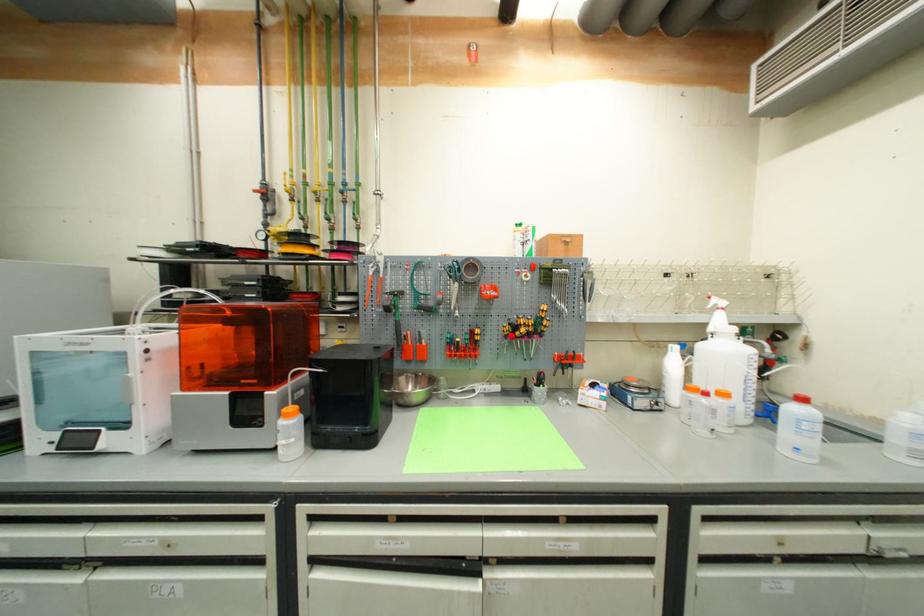
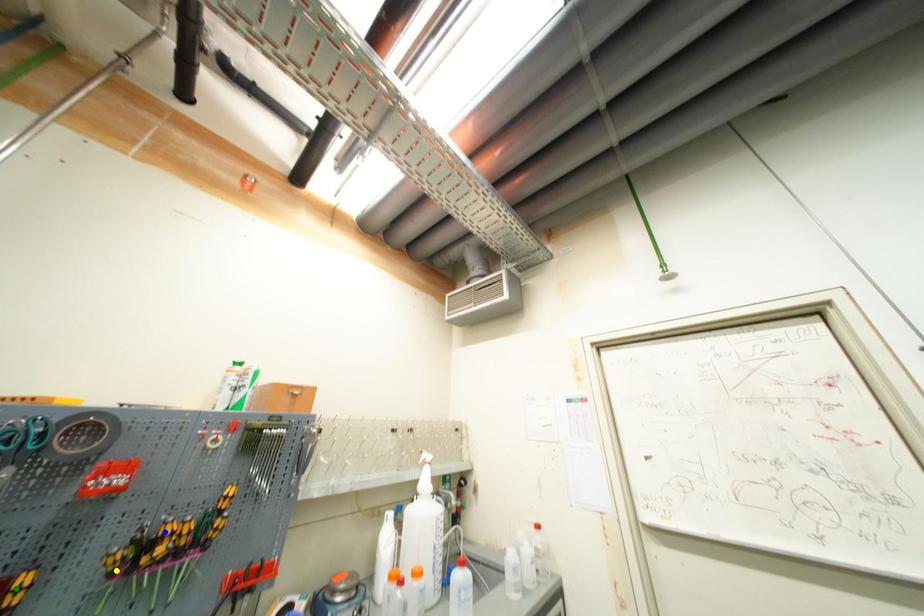
Question: I am providing you with two images of the same scene from different viewpoints. A red point is marked on the first image. You are given multiple points on the second image. Can you choose the point in image 2 that corresponds to the point in image 1?

Choices:
 (A) yellow point
 (B) blue point
 (C) green point

Answer: (A)